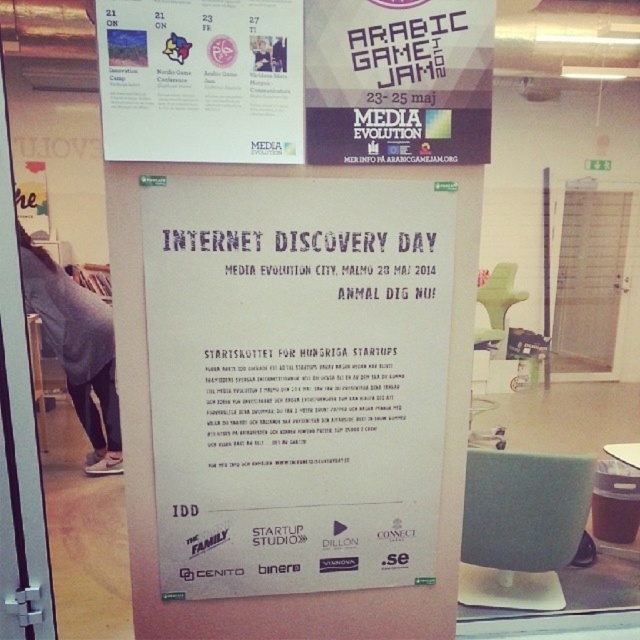
You are an event planner trying to hang decorations for an upcoming event. You have a white paper poster at upper center and a matte white sign at upper center. Which object should you place first to ensure proper visibility of both items?

You should place the matte white sign at upper center first because the white paper poster at upper center is in front of it, ensuring that the sign remains visible behind the poster.

You are at an event venue and see the white paper poster at center and the matte white sign at upper center. Which one is taller?

The white paper poster at center is taller than the matte white sign at upper center.

You are at an event and see the poster for Internet Discovery Day. There is a point marked at coordinates (202, 81) on the poster. What is located at that point?

The point at coordinates (202, 81) indicates the white paper poster at upper center.